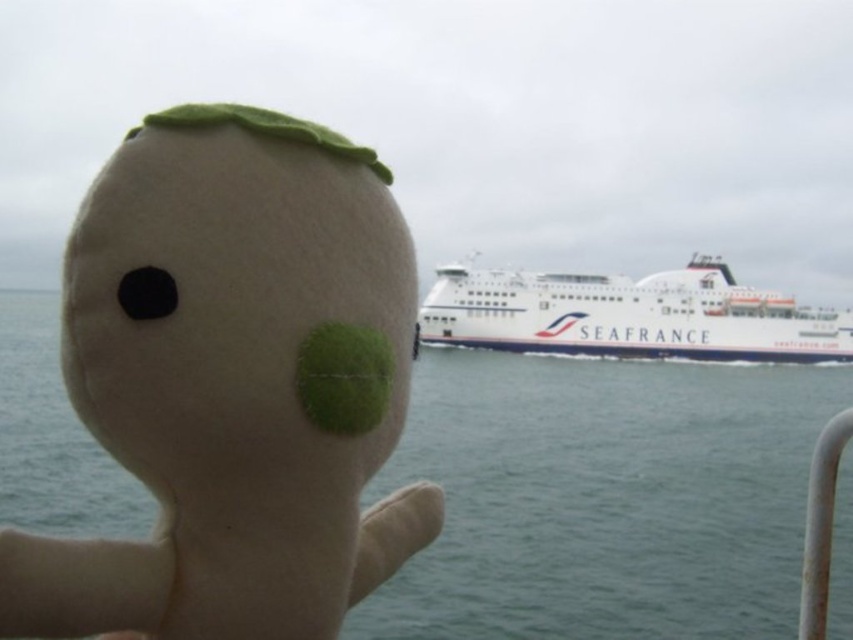
The width and height of the screenshot is (853, 640). What do you see at coordinates (604, 497) in the screenshot?
I see `green felt water at center` at bounding box center [604, 497].

Can you confirm if green felt water at center is taller than white matte ferry at center?

Yes, green felt water at center is taller than white matte ferry at center.

Is point (486, 392) behind point (833, 339)?

No, it is in front of (833, 339).

At what (x,y) coordinates should I click in order to perform the action: click on green felt water at center. Please return your answer as a coordinate pair (x, y). The height and width of the screenshot is (640, 853). Looking at the image, I should click on (604, 497).

Measure the distance between felt toy at center and camera.

felt toy at center is 5.41 meters from camera.

Image resolution: width=853 pixels, height=640 pixels. Find the location of `felt toy at center`. felt toy at center is located at coordinates (233, 381).

Where is `felt toy at center`? felt toy at center is located at coordinates (233, 381).

Can you confirm if felt toy at center is shorter than green felt water at center?

Correct, felt toy at center is not as tall as green felt water at center.

Who is more forward, (x=68, y=260) or (x=587, y=522)?

Point (x=68, y=260) is in front.

Identify the location of felt toy at center. Image resolution: width=853 pixels, height=640 pixels. (233, 381).